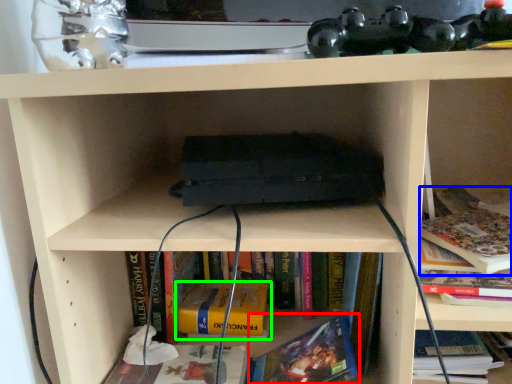
Question: Considering the real-world distances, which object is closest to book (highlighted by a red box)? book (highlighted by a blue box) or book (highlighted by a green box).

Choices:
 (A) book
 (B) book

Answer: (B)